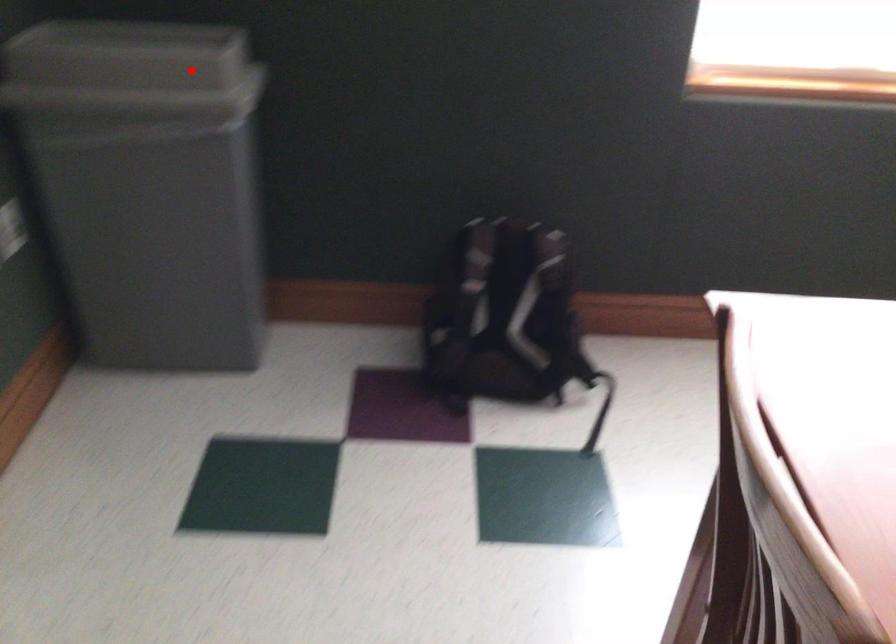
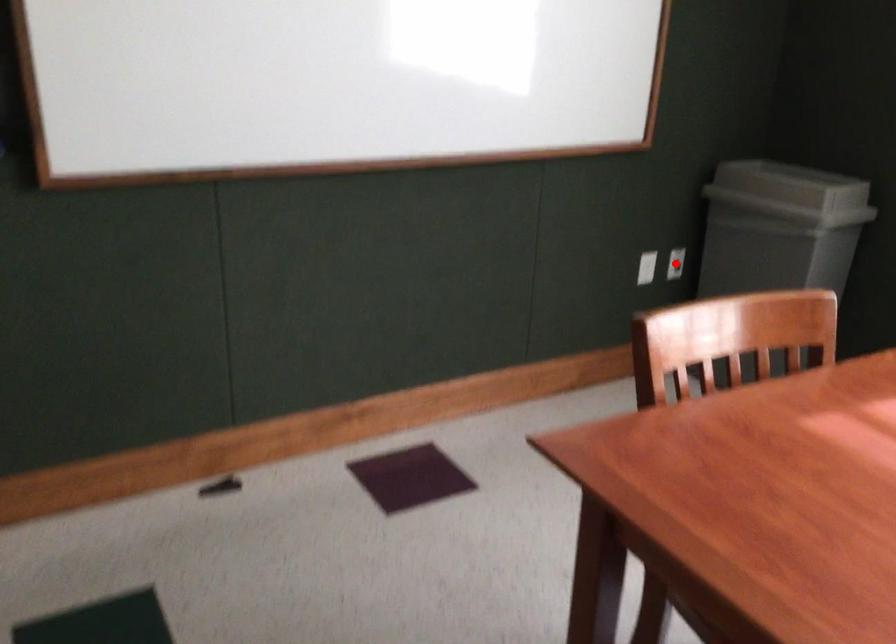
I am providing you with two images of the same scene from different viewpoints. A red point is marked on the first image and another point is marked on the second image. Does the point marked in image1 correspond to the same location as the one in image2?

No